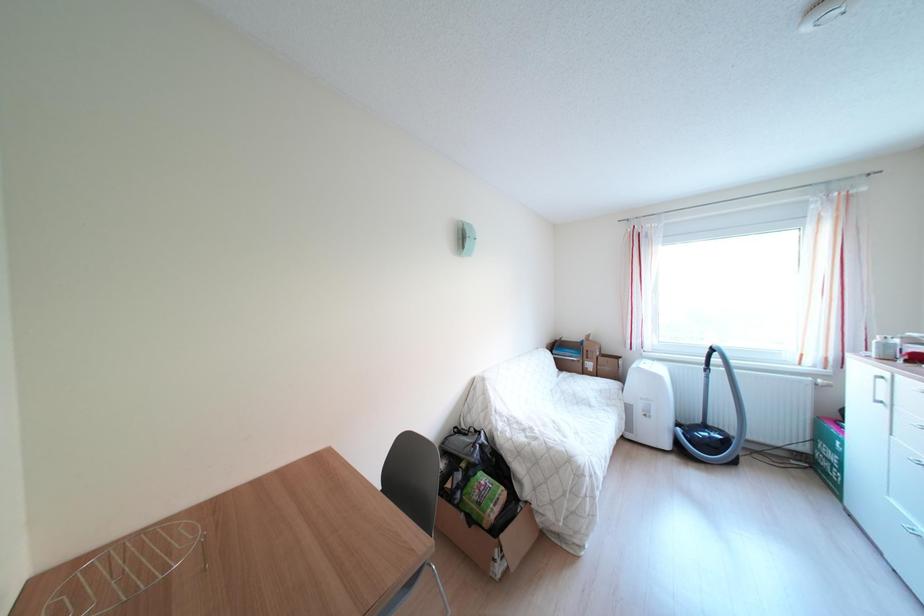
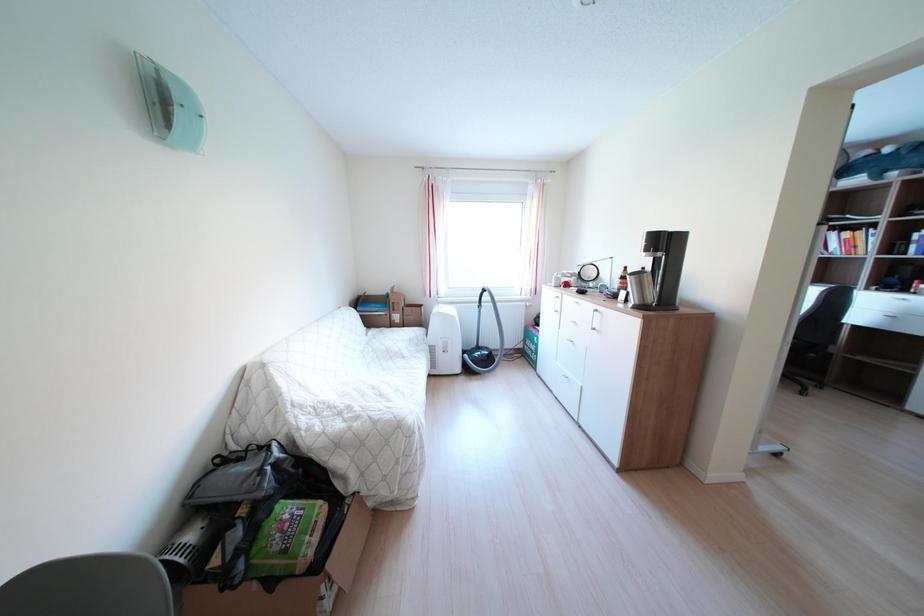
Question: The camera is either moving clockwise (left) or counter-clockwise (right) around the object. The first image is from the beginning of the video and the second image is from the end. Is the camera moving left or right when shooting the video?

Choices:
 (A) Left
 (B) Right

Answer: (A)